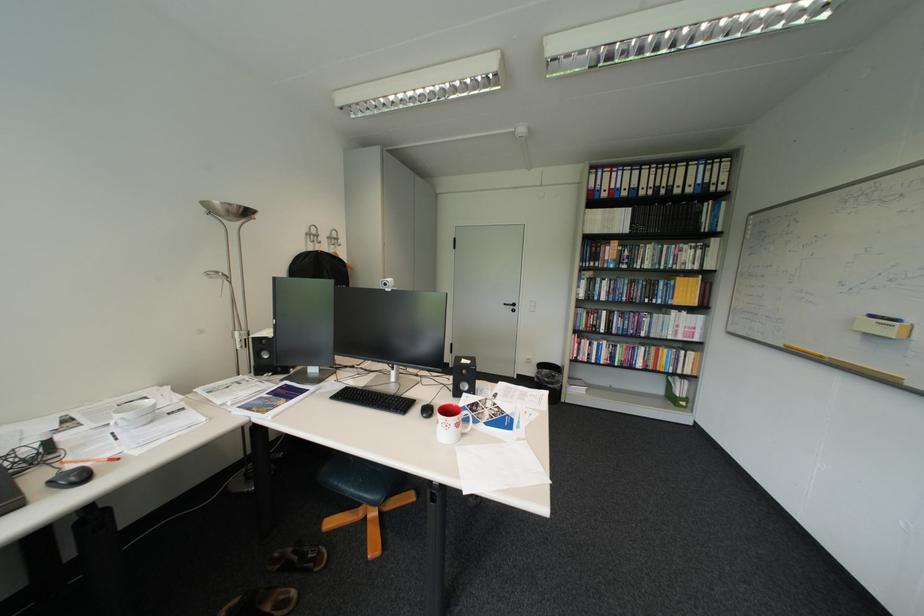
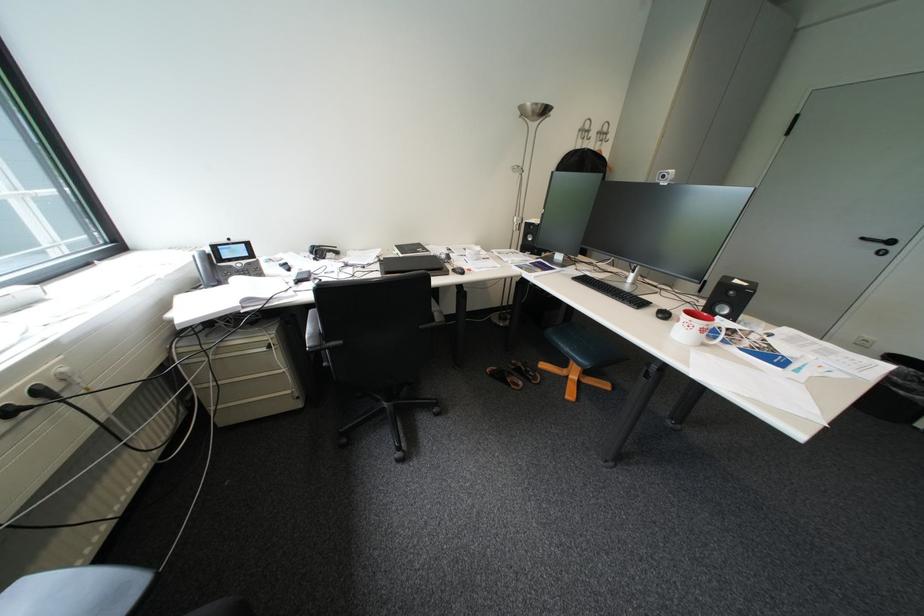
The point at (526, 305) is marked in the first image. Where is the corresponding point in the second image?

(904, 243)